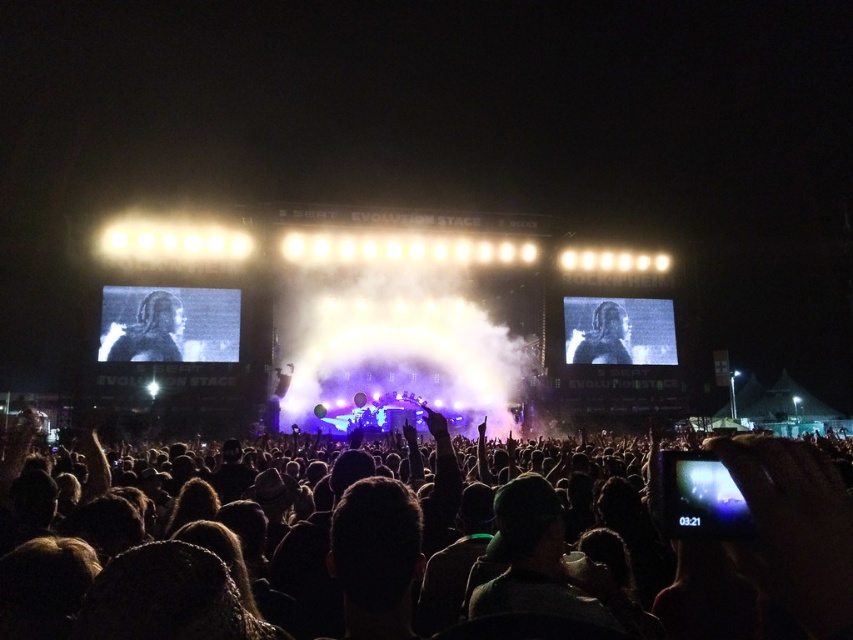
You are a photographer at the concert and want to take a clear photo of the smooth skin face at center without the gray metallic figure at center blocking it. What should you do?

The gray metallic figure at center is positioned over the smooth skin face at center, so you should move your camera angle slightly downward to avoid the obstruction.

You are standing at the origin point of the image. Where is the black matte crowd at center located in terms of coordinates?

The black matte crowd at center is located at coordinates point (793, 529).

You are a photographer positioned at the camera. You want to capture a clear photo of the black matte crowd at center. Considering the distance between you and the crowd, is it feasible to take the photo without any additional equipment?

The distance between the photographer and the black matte crowd at center is 78.99 meters. Without additional equipment like a telephoto lens, capturing a clear photo from this distance may be challenging due to the limitations of standard camera lenses.